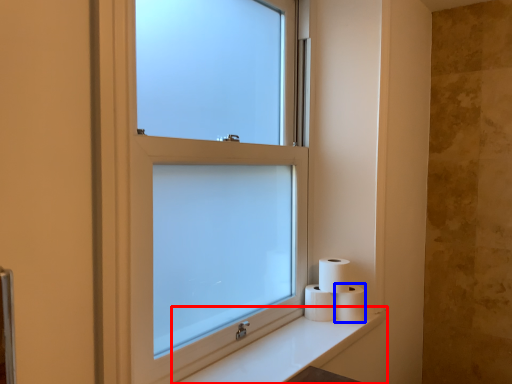
Question: Which of the following is the closest to the observer, counter top (highlighted by a red box) or toilet paper (highlighted by a blue box)?

Choices:
 (A) counter top
 (B) toilet paper

Answer: (A)